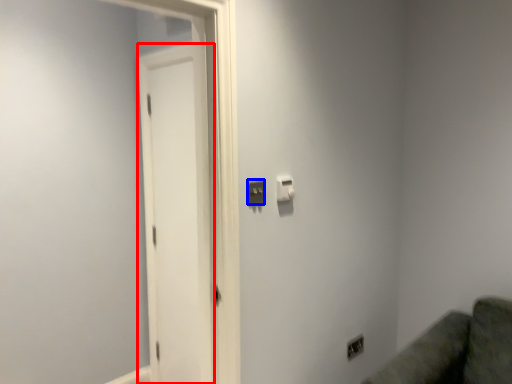
Question: Among these objects, which one is nearest to the camera, screen door (highlighted by a red box) or light switch (highlighted by a blue box)?

Choices:
 (A) screen door
 (B) light switch

Answer: (B)